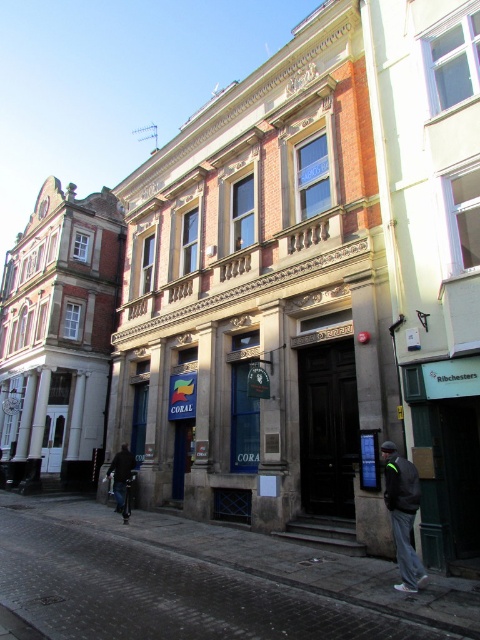
Question: Which point is farther to the camera?

Choices:
 (A) dark gray jacket at lower right
 (B) dark blue jeans at lower left

Answer: (B)

Question: Is dark gray jacket at lower right positioned behind dark blue jeans at lower left?

Choices:
 (A) yes
 (B) no

Answer: (B)

Question: Which point is farther from the camera taking this photo?

Choices:
 (A) (388, 493)
 (B) (126, 476)

Answer: (B)

Question: Is dark gray jacket at lower right to the left of dark blue jeans at lower left from the viewer's perspective?

Choices:
 (A) yes
 (B) no

Answer: (B)

Question: Does dark gray jacket at lower right appear over dark blue jeans at lower left?

Choices:
 (A) yes
 (B) no

Answer: (A)